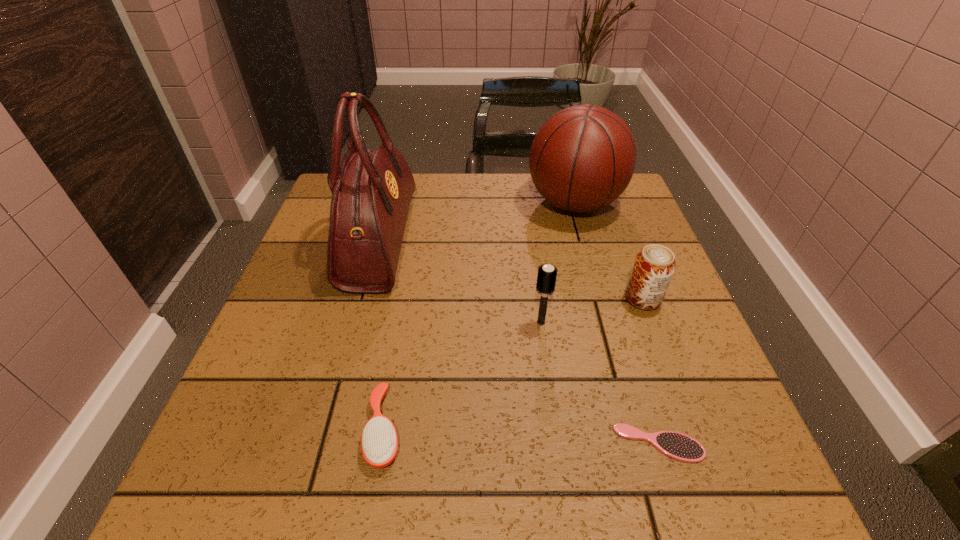
Identify the location of vacant point located 0.110m on the front of the basketball. (590, 261).

The image size is (960, 540). In order to click on vacant space located 0.080m on the back of the second hairbrush from left to right in this screenshot , I will do `click(537, 288)`.

You are a GUI agent. You are given a task and a screenshot of the screen. Output one action in this format:
    pyautogui.click(x=<x>, y=<y>)
    Task: Click on the vacant region located on the left of the fourth tallest object
    
    Given the screenshot: What is the action you would take?
    pyautogui.click(x=467, y=299)

What are the coordinates of `vacant point located 0.370m on the right of the leftmost hairbrush` in the screenshot? It's located at (627, 429).

The image size is (960, 540). Find the location of `vacant space located 0.080m on the left of the shortest hairbrush`. vacant space located 0.080m on the left of the shortest hairbrush is located at coordinates (566, 443).

The height and width of the screenshot is (540, 960). I want to click on handbag at the far edge, so click(371, 190).

Find the location of `basketball located in the far edge section of the desktop`. basketball located in the far edge section of the desktop is located at coordinates (582, 159).

This screenshot has height=540, width=960. In order to click on object that is at the left edge in this screenshot , I will do [x=371, y=190].

Locate an element on the screen. basketball at the right edge is located at coordinates (582, 159).

The height and width of the screenshot is (540, 960). I want to click on beer can that is at the right edge, so click(654, 266).